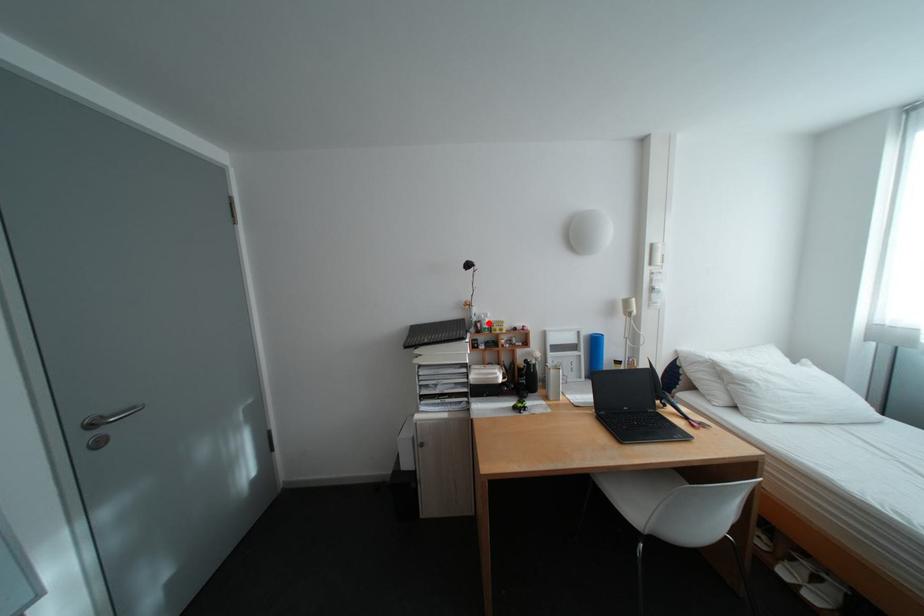
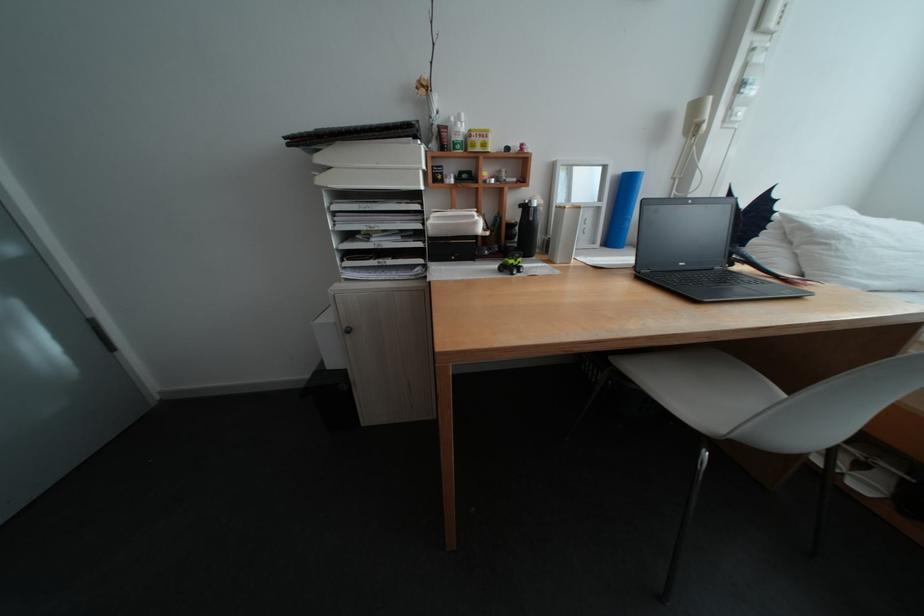
The point at the highlighted location is marked in the first image. Where is the corresponding point in the second image?

(453, 128)